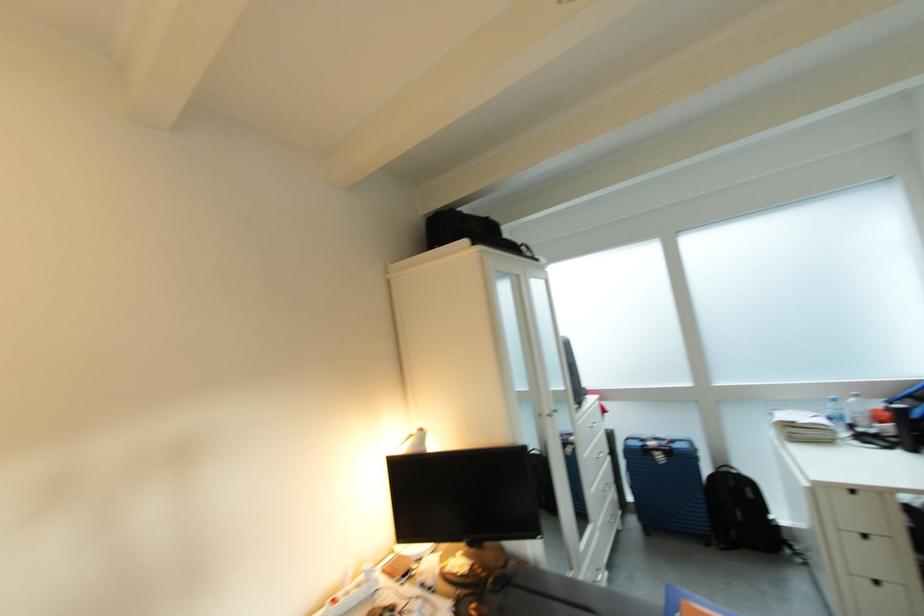
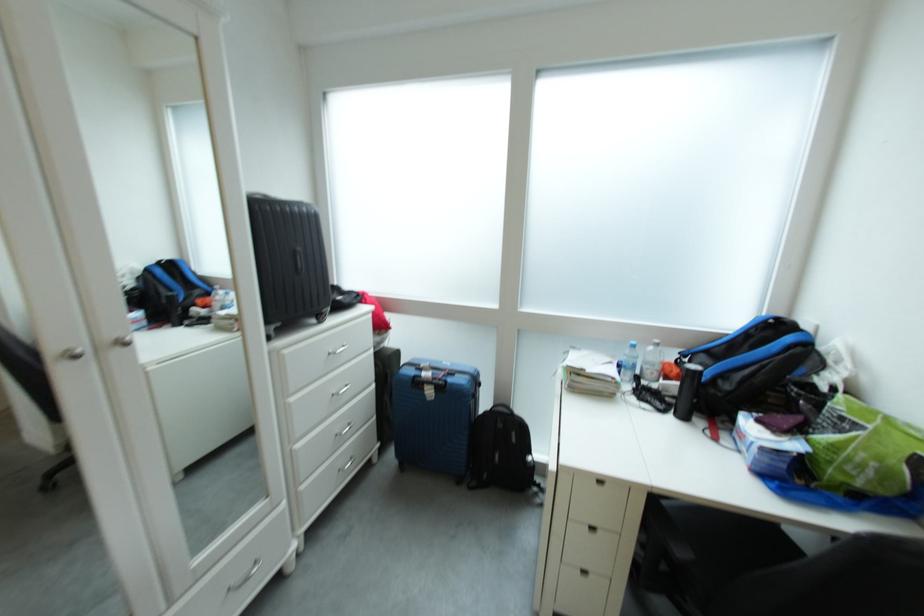
Find the pixel in the second image that matches (836,431) in the first image.

(622, 383)